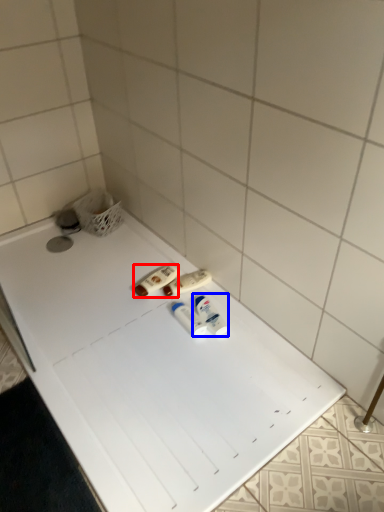
Question: Which object appears farthest to the camera in this image, toiletry (highlighted by a red box) or toiletry (highlighted by a blue box)?

Choices:
 (A) toiletry
 (B) toiletry

Answer: (A)